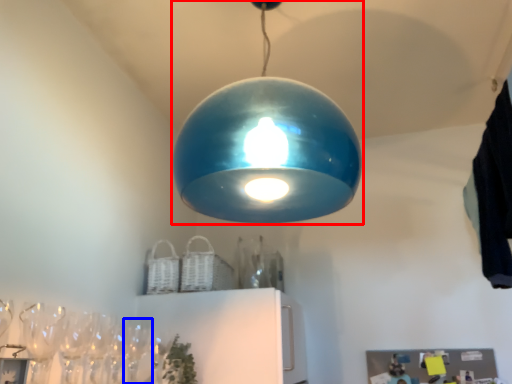
Question: Among these objects, which one is farthest to the camera, lamp (highlighted by a red box) or wine glass (highlighted by a blue box)?

Choices:
 (A) lamp
 (B) wine glass

Answer: (B)